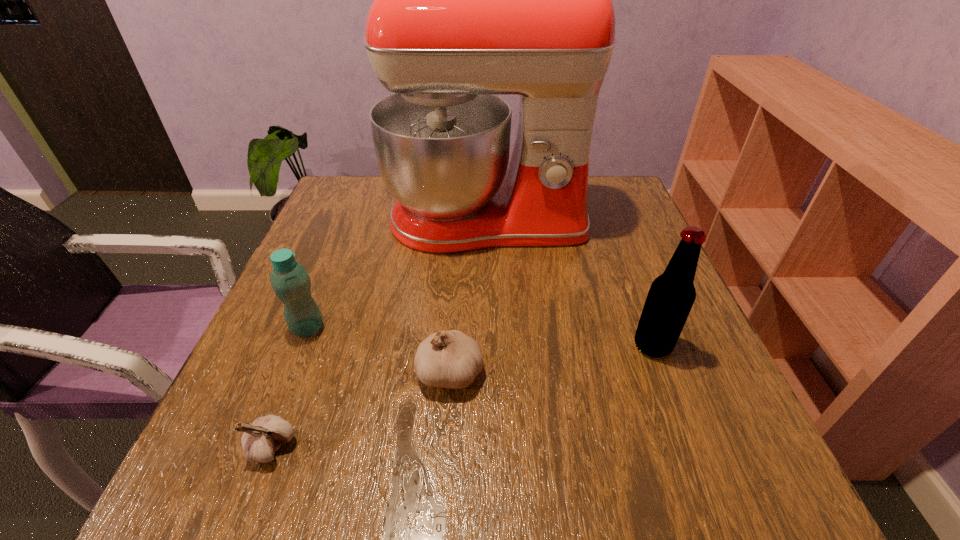
The image size is (960, 540). In order to click on object located at the near left corner in this screenshot , I will do coord(260,440).

At what (x,y) coordinates should I click in order to perform the action: click on object that is at the far right corner. Please return your answer as a coordinate pair (x, y). This screenshot has width=960, height=540. Looking at the image, I should click on (471, 0).

At what (x,y) coordinates should I click in order to perform the action: click on free space at the near edge of the desktop. Please return your answer as a coordinate pair (x, y). Looking at the image, I should click on (644, 478).

Locate an element on the screen. This screenshot has height=540, width=960. vacant space at the right edge of the desktop is located at coordinates point(689,350).

Where is `free space at the far left corner of the desktop`? This screenshot has width=960, height=540. free space at the far left corner of the desktop is located at coordinates (363, 194).

Find the location of `free location at the far right corner`. free location at the far right corner is located at coordinates (606, 204).

Where is `free spot between the tallest object and the third tallest object`? This screenshot has width=960, height=540. free spot between the tallest object and the third tallest object is located at coordinates (397, 275).

Locate an element on the screen. vacant area between the shortest object and the fourth shortest object is located at coordinates 463,396.

Image resolution: width=960 pixels, height=540 pixels. I want to click on free point between the right garlic and the farthest object, so click(x=468, y=296).

At what (x,y) coordinates should I click in order to perform the action: click on free space between the left garlic and the tallest object. Please return your answer as a coordinate pair (x, y). The image size is (960, 540). Looking at the image, I should click on (379, 334).